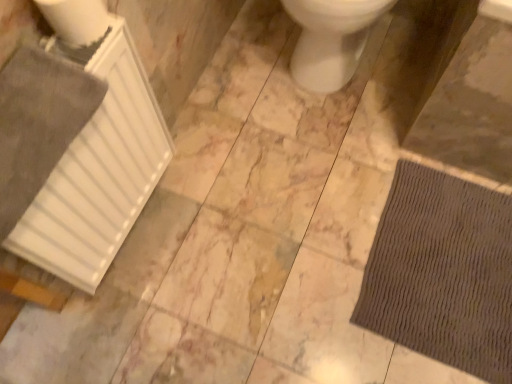
Question: Based on their sizes in the image, would you say brown textured mat at lower right is bigger or smaller than white glossy toilet at center?

Choices:
 (A) small
 (B) big

Answer: (A)

Question: From a real-world perspective, relative to white glossy toilet at center, is brown textured mat at lower right vertically above or below?

Choices:
 (A) above
 (B) below

Answer: (B)

Question: Which object is positioned farthest from the white matte radiator at left?

Choices:
 (A) brown textured mat at lower right
 (B) white glossy toilet at center

Answer: (A)

Question: Estimate the real-world distances between objects in this image. Which object is farther from the white matte radiator at left?

Choices:
 (A) brown textured mat at lower right
 (B) white glossy toilet at center

Answer: (A)